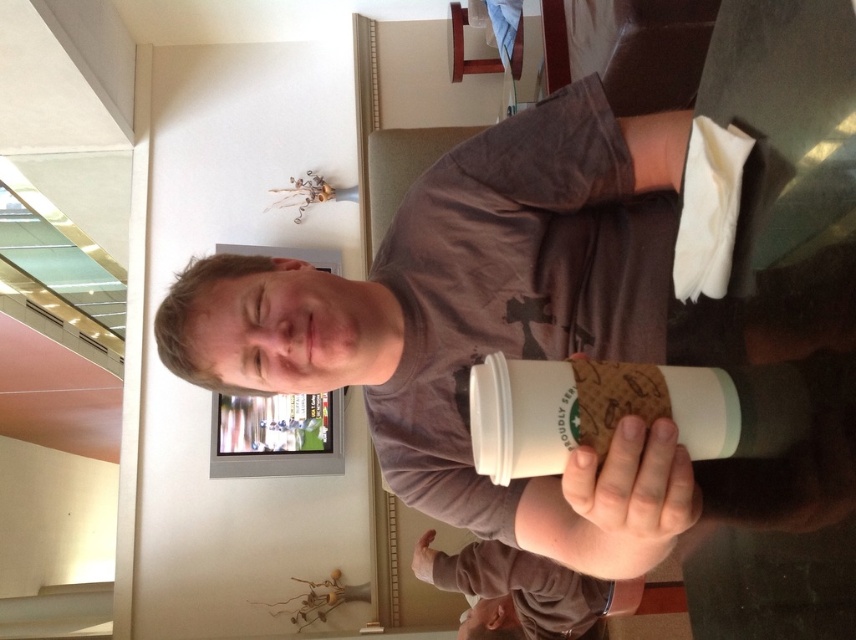
In the scene shown: You are taking a photo of the scene and want to focus on both the point at (x=201, y=305) and the point at (x=519, y=604). Which point should you adjust your focus to first to ensure both are in the clearest possible view?

You should focus on point (x=201, y=305) first because it is closer to the camera than point (x=519, y=604). This ensures that both points will be in focus as the depth of field will extend from the closer point to the farther one.